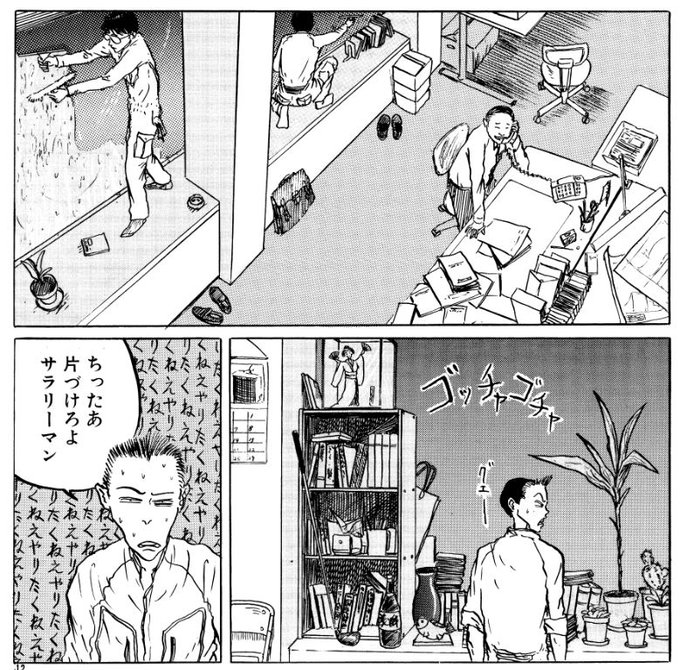
Where is `chair`? This screenshot has width=680, height=670. chair is located at coordinates (571, 70), (255, 612).